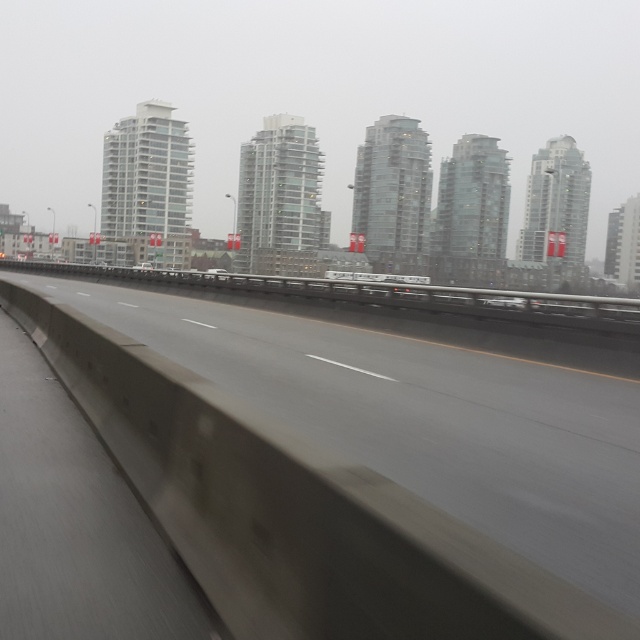
Question: Is concrete at center positioned in front of white glossy car at center?

Choices:
 (A) no
 (B) yes

Answer: (B)

Question: Which object appears closest to the camera in this image?

Choices:
 (A) concrete at center
 (B) white glossy car at center

Answer: (A)

Question: Does concrete at center come behind white glossy car at center?

Choices:
 (A) yes
 (B) no

Answer: (B)

Question: Is concrete at center closer to the viewer compared to white glossy car at center?

Choices:
 (A) yes
 (B) no

Answer: (A)

Question: Which point appears closest to the camera in this image?

Choices:
 (A) (472, 588)
 (B) (145, 268)

Answer: (A)